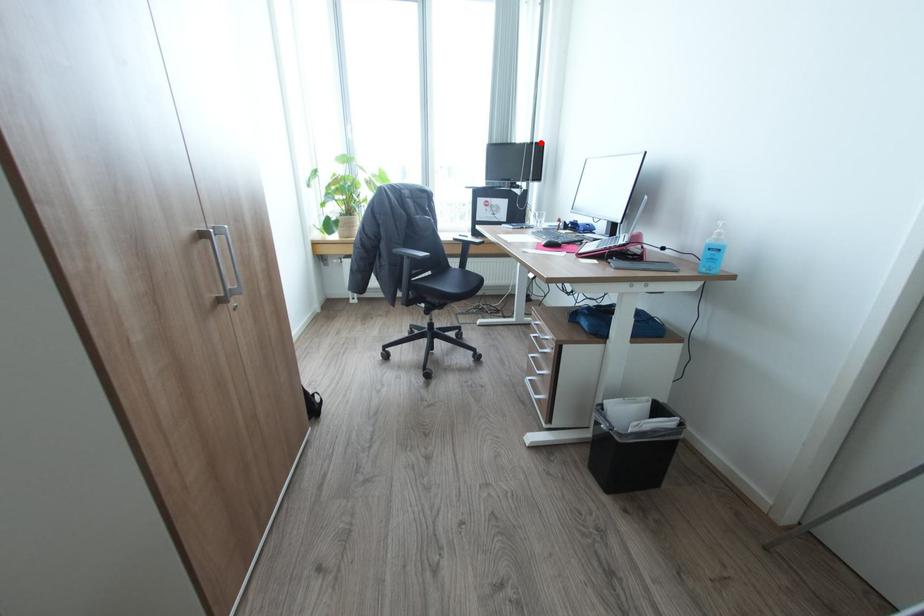
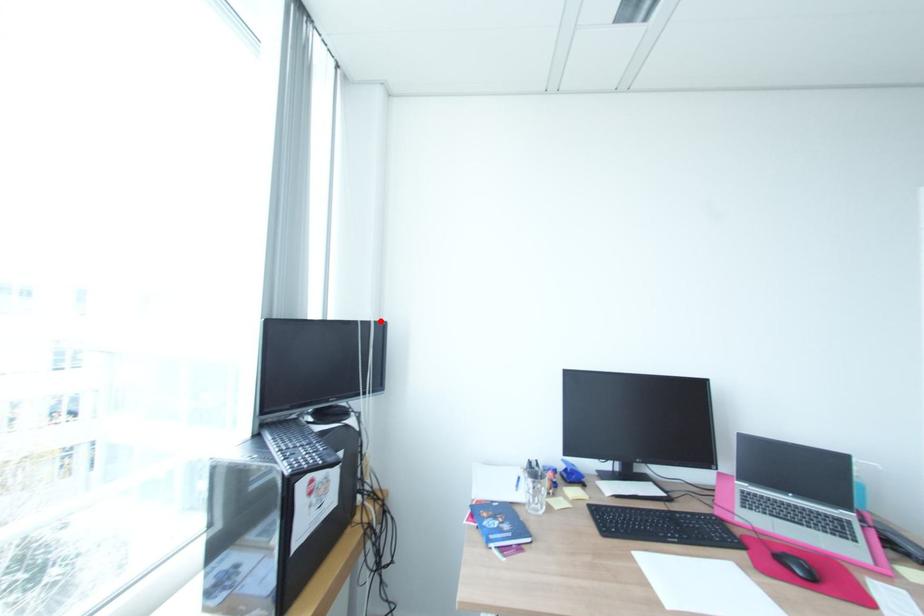
I am providing you with two images of the same scene from different viewpoints. A red point is marked on the first image and another point is marked on the second image. Is the marked point in image1 the same physical position as the marked point in image2?

Yes